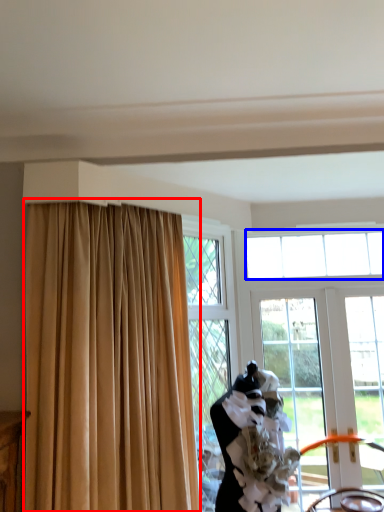
Question: Which object is further to the camera taking this photo, curtain (highlighted by a red box) or window (highlighted by a blue box)?

Choices:
 (A) curtain
 (B) window

Answer: (B)